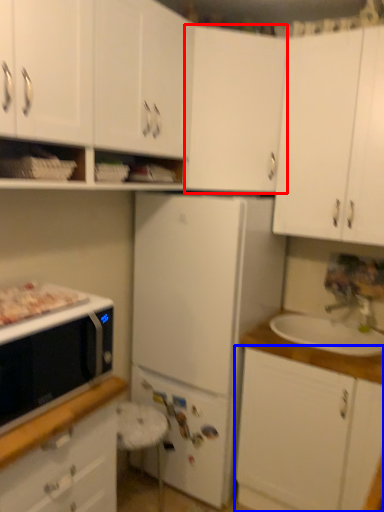
Question: Which object is further to the camera taking this photo, cabinetry (highlighted by a red box) or cabinetry (highlighted by a blue box)?

Choices:
 (A) cabinetry
 (B) cabinetry

Answer: (A)